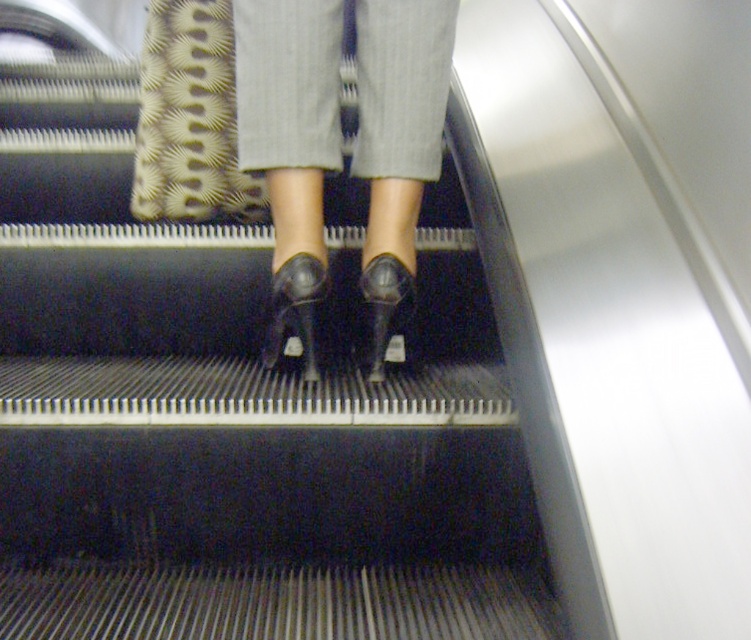
Between point (385, 211) and point (321, 280), which one is positioned in front?

Point (321, 280)

Describe the element at coordinates (290, 141) in the screenshot. I see `black leather high heels at center` at that location.

At what (x,y) coordinates should I click in order to perform the action: click on black leather high heels at center. Please return your answer as a coordinate pair (x, y). Looking at the image, I should click on (290, 141).

Does shiny black high-heeled shoe at center lie in front of shiny black shoe at center?

That is True.

Can you confirm if shiny black high-heeled shoe at center is positioned to the left of shiny black shoe at center?

Correct, you'll find shiny black high-heeled shoe at center to the left of shiny black shoe at center.

Is point (276, 316) closer to viewer compared to point (362, 371)?

Yes.

You are a GUI agent. You are given a task and a screenshot of the screen. Output one action in this format:
    pyautogui.click(x=<x>, y=<y>)
    Task: Click on the shiny black high-heeled shoe at center
    The image size is (751, 640).
    Given the screenshot: What is the action you would take?
    pyautogui.click(x=294, y=310)

Is black leather high heels at center wider than shiny black shoe at center?

Indeed, black leather high heels at center has a greater width compared to shiny black shoe at center.

Based on the photo, is black leather high heels at center above shiny black shoe at center?

Yes, black leather high heels at center is above shiny black shoe at center.

The width and height of the screenshot is (751, 640). I want to click on black leather high heels at center, so click(290, 141).